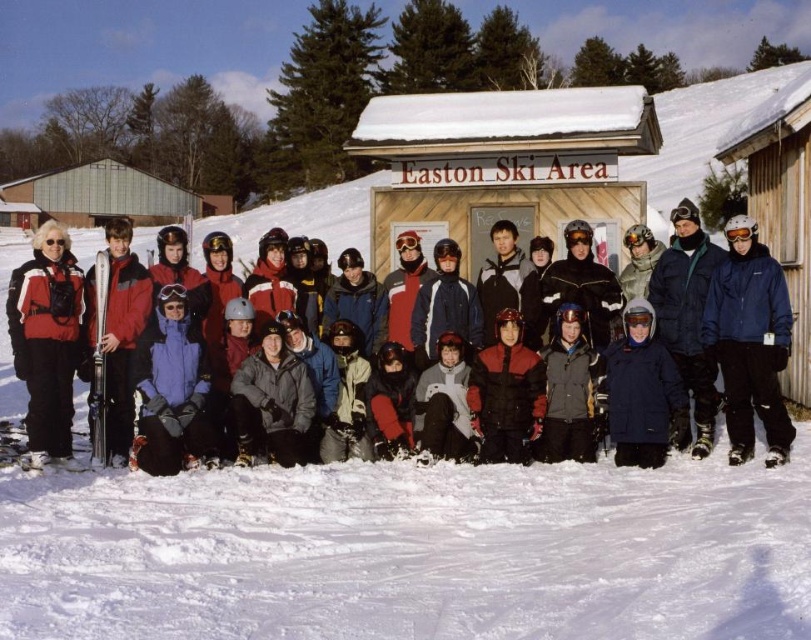
Question: Is blue waterproof jacket at right wider than brushed metal hut at upper left?

Choices:
 (A) yes
 (B) no

Answer: (B)

Question: Where is wooden sign at center located in relation to matte red jacket at left in the image?

Choices:
 (A) above
 (B) below

Answer: (A)

Question: Which of the following is the farthest from the observer?

Choices:
 (A) (59, 339)
 (B) (311, 218)

Answer: (B)

Question: Observing the image, what is the correct spatial positioning of blue waterproof jacket at right in reference to matte red jacket at left?

Choices:
 (A) right
 (B) left

Answer: (A)

Question: Estimate the real-world distances between objects in this image. Which object is closer to the matte black jacket at center?

Choices:
 (A) blue waterproof jacket at right
 (B) wooden sign at center
 (C) brushed metal hut at upper left
 (D) matte red jacket at left

Answer: (C)

Question: Which object is the closest to the brushed metal hut at upper left?

Choices:
 (A) matte red jacket at left
 (B) matte black jacket at center

Answer: (B)